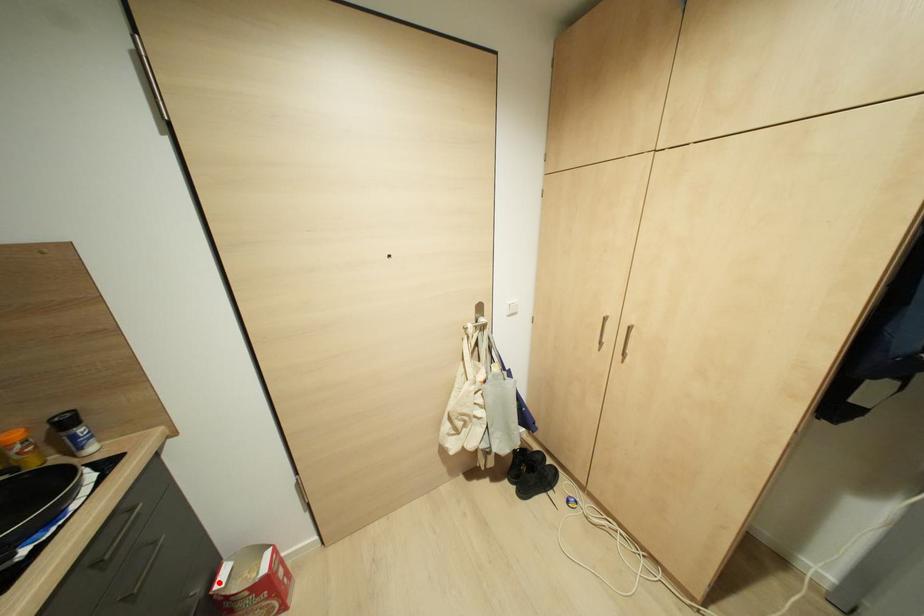
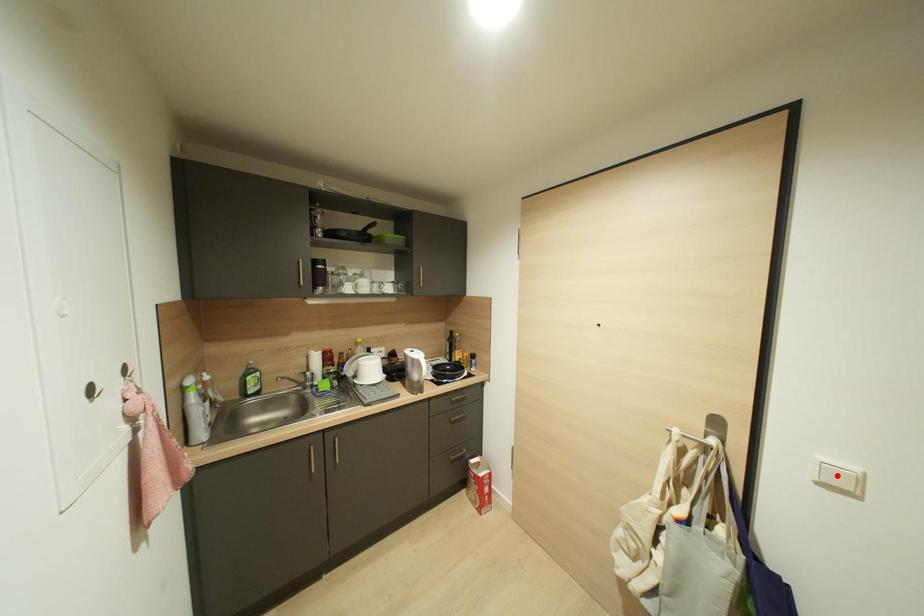
I am providing you with two images of the same scene from different viewpoints. A red point is marked on the first image and another point is marked on the second image. Does the point marked in image1 correspond to the same location as the one in image2?

No